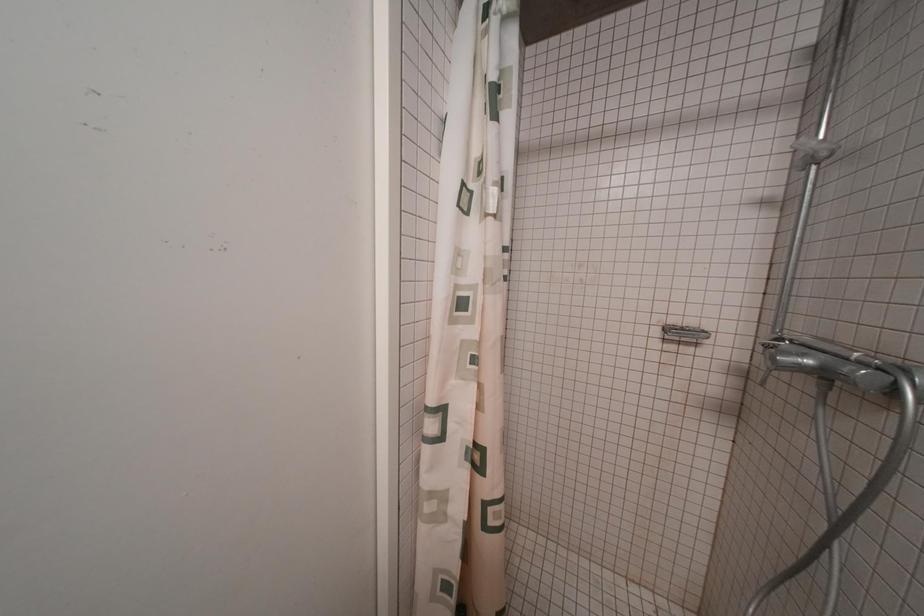
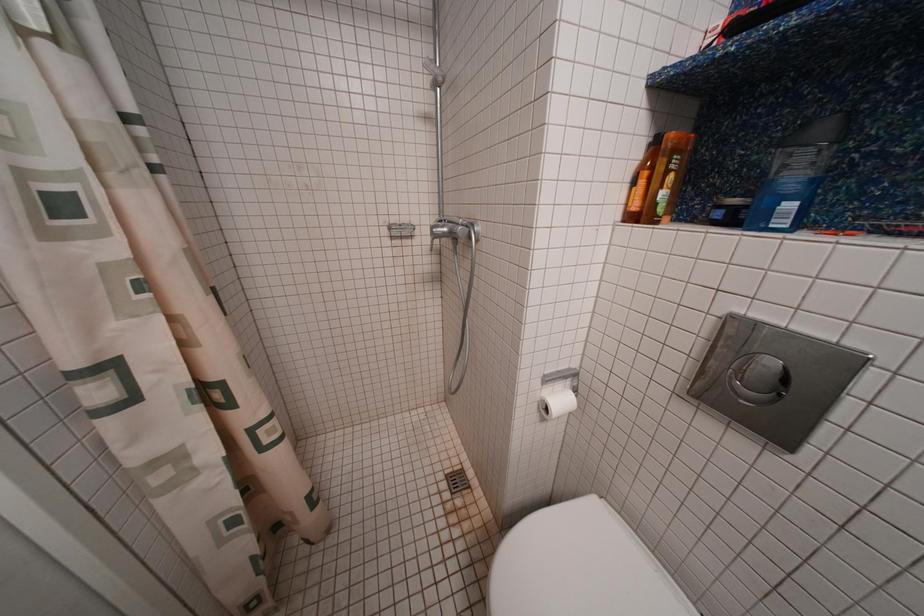
The first image is from the beginning of the video and the second image is from the end. How did the camera likely rotate when shooting the video?

The camera's rotation is toward right-down.